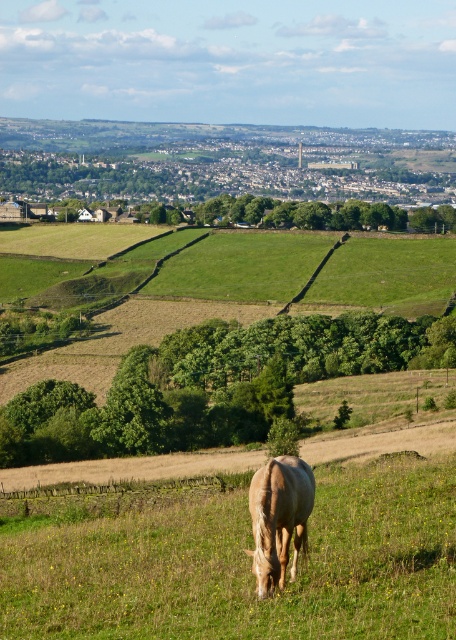
Is green grassy field at center shorter than light brown horse at center?

Incorrect, green grassy field at center's height does not fall short of light brown horse at center's.

Can you confirm if green grassy field at center is positioned to the left of light brown horse at center?

Yes, green grassy field at center is to the left of light brown horse at center.

Who is more forward, (383, 609) or (301, 500)?

Point (383, 609) is more forward.

Locate an element on the screen. green grassy field at center is located at coordinates (244, 566).